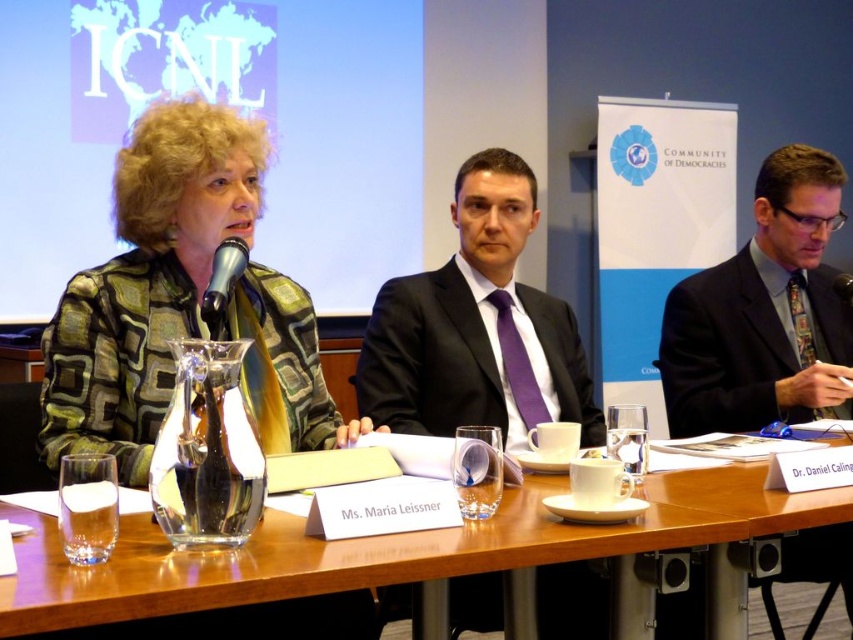
Question: Does black satin suit at center appear over metallic silver microphone at center?

Choices:
 (A) no
 (B) yes

Answer: (A)

Question: Which point appears closest to the camera in this image?

Choices:
 (A) (680, 301)
 (B) (532, 332)
 (C) (322, 435)

Answer: (C)

Question: Considering the relative positions of green textured blazer at center and wooden table at center in the image provided, where is green textured blazer at center located with respect to wooden table at center?

Choices:
 (A) below
 (B) above

Answer: (B)

Question: Can you confirm if wooden table at center is thinner than dark blue suit at right?

Choices:
 (A) yes
 (B) no

Answer: (B)

Question: Which point is farther to the camera?

Choices:
 (A) metallic silver microphone at center
 (B) green textured blazer at center

Answer: (A)

Question: Which object is the farthest from the shiny metallic microphone at center?

Choices:
 (A) green textured blazer at center
 (B) metallic silver microphone at center
 (C) wooden table at center

Answer: (B)